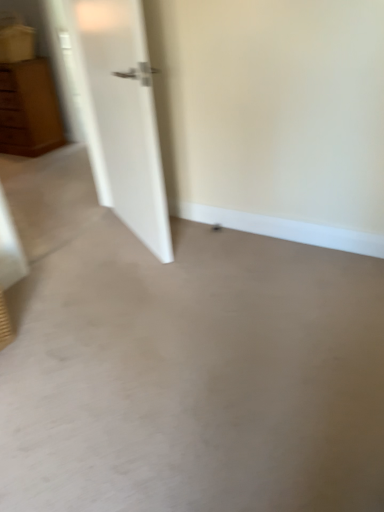
Question: Relative to beige matte concrete at center, is matte brown chest of drawers at left in front or behind?

Choices:
 (A) front
 (B) behind

Answer: (B)

Question: Is matte brown chest of drawers at left inside the boundaries of beige matte concrete at center, or outside?

Choices:
 (A) inside
 (B) outside

Answer: (B)

Question: Would you say matte brown chest of drawers at left is to the left or to the right of beige matte concrete at center in the picture?

Choices:
 (A) right
 (B) left

Answer: (B)

Question: Looking at their shapes, would you say beige matte concrete at center is wider or thinner than matte brown chest of drawers at left?

Choices:
 (A) wide
 (B) thin

Answer: (A)

Question: Is beige matte concrete at center in front of or behind matte brown chest of drawers at left in the image?

Choices:
 (A) behind
 (B) front

Answer: (B)

Question: Does point (339, 266) appear closer or farther from the camera than point (3, 77)?

Choices:
 (A) farther
 (B) closer

Answer: (B)

Question: Do you think beige matte concrete at center is within matte brown chest of drawers at left, or outside of it?

Choices:
 (A) inside
 (B) outside

Answer: (B)